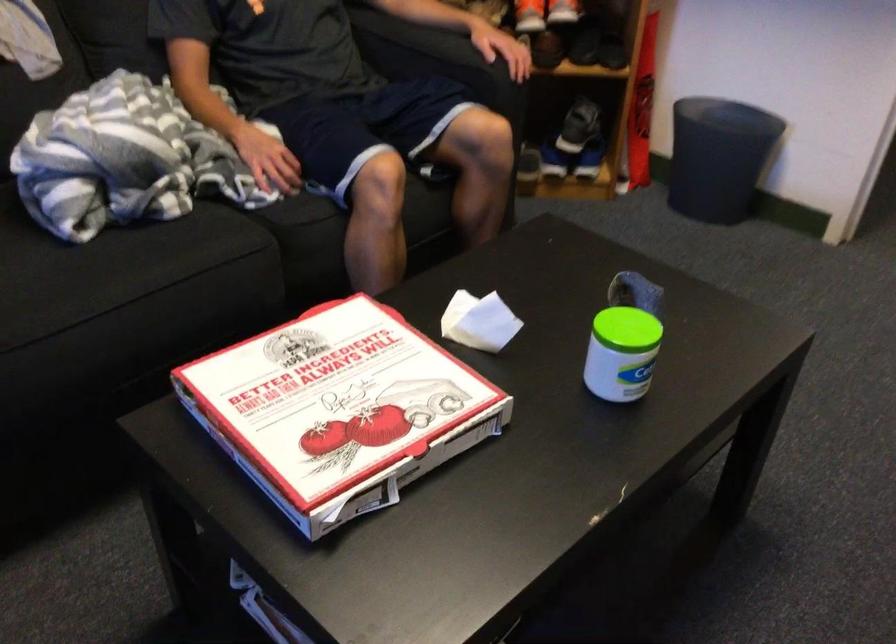
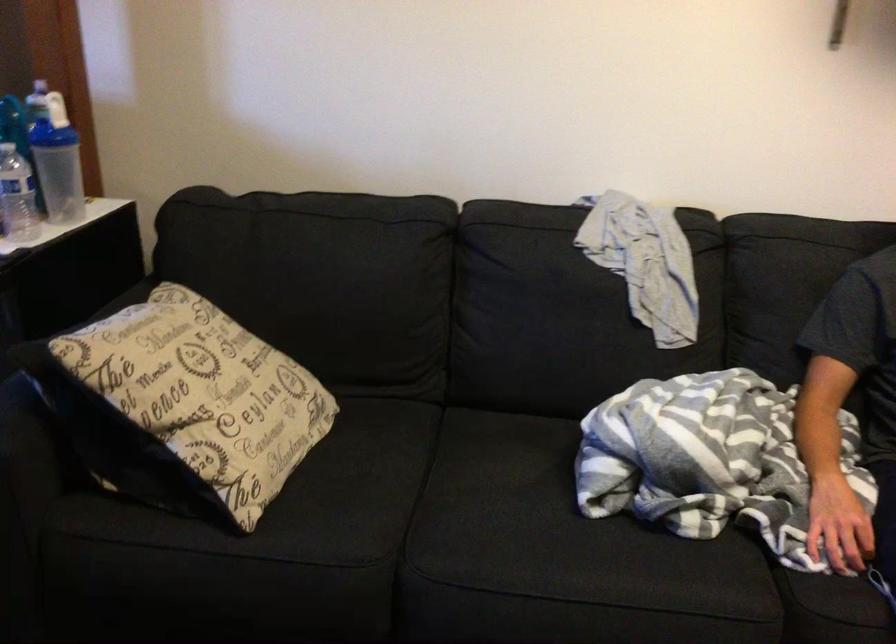
Question: Based on the continuous images, in which direction is the camera rotating? Reply with the corresponding letter.

Choices:
 (A) Left
 (B) Right
 (C) Up
 (D) Down

Answer: (A)